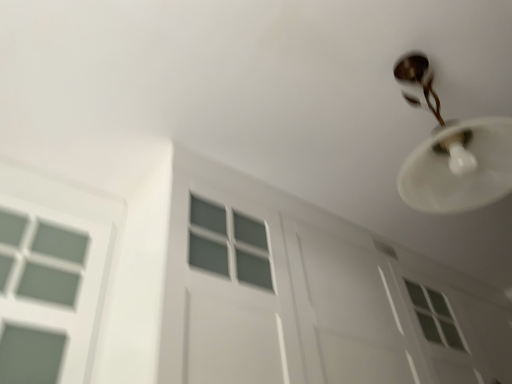
Question: Should I look upward or downward to see white painted wood garage door at center?

Choices:
 (A) down
 (B) up

Answer: (A)